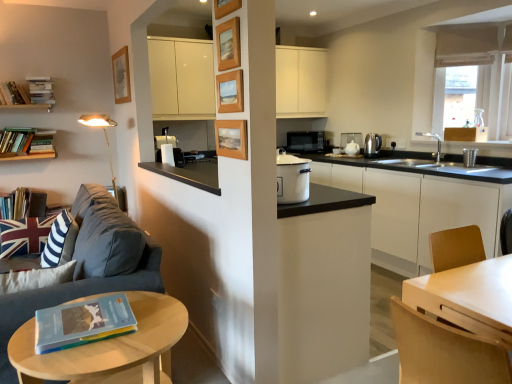
Where is `empty space that is ontop of hardcover books at upper left, the second book from the back (from a real-world perspective)`? The image size is (512, 384). empty space that is ontop of hardcover books at upper left, the second book from the back (from a real-world perspective) is located at coordinates (37, 79).